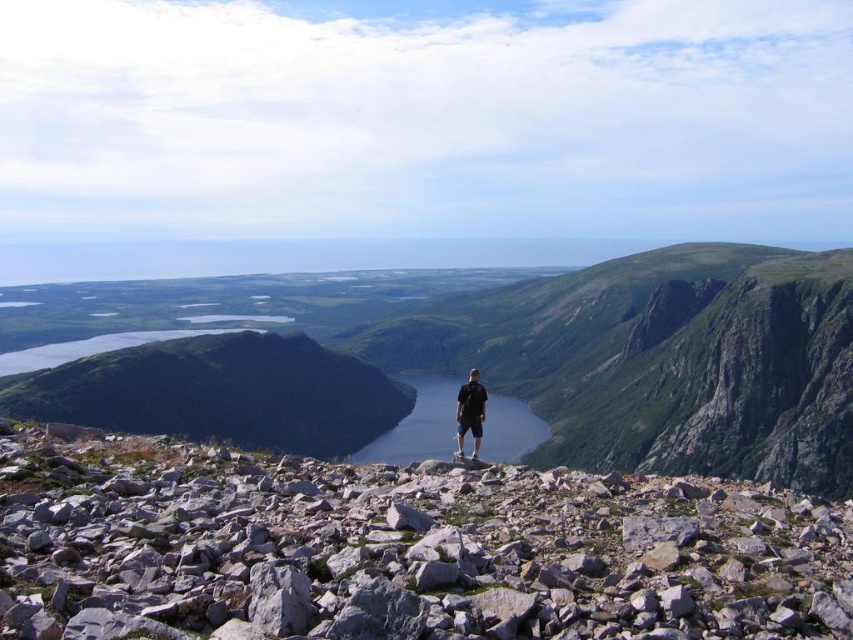
Question: Which of the following is the closest to the observer?

Choices:
 (A) green grassy mountain at center
 (B) black cotton shirt at center
 (C) gray rock at center

Answer: (C)

Question: Does shiny blue water at center appear over black cotton shirt at center?

Choices:
 (A) yes
 (B) no

Answer: (B)

Question: Considering the relative positions of gray rock at center and shiny blue water at center in the image provided, where is gray rock at center located with respect to shiny blue water at center?

Choices:
 (A) above
 (B) below

Answer: (A)

Question: Is shiny blue water at center bigger than black cotton shirt at center?

Choices:
 (A) yes
 (B) no

Answer: (A)

Question: Which object is closer to the camera taking this photo?

Choices:
 (A) black cotton shirt at center
 (B) green grassy mountain at center
 (C) shiny blue water at center

Answer: (A)

Question: Which object appears farthest from the camera in this image?

Choices:
 (A) black cotton shirt at center
 (B) shiny blue water at center
 (C) green grassy mountain at center
 (D) gray rock at center

Answer: (C)